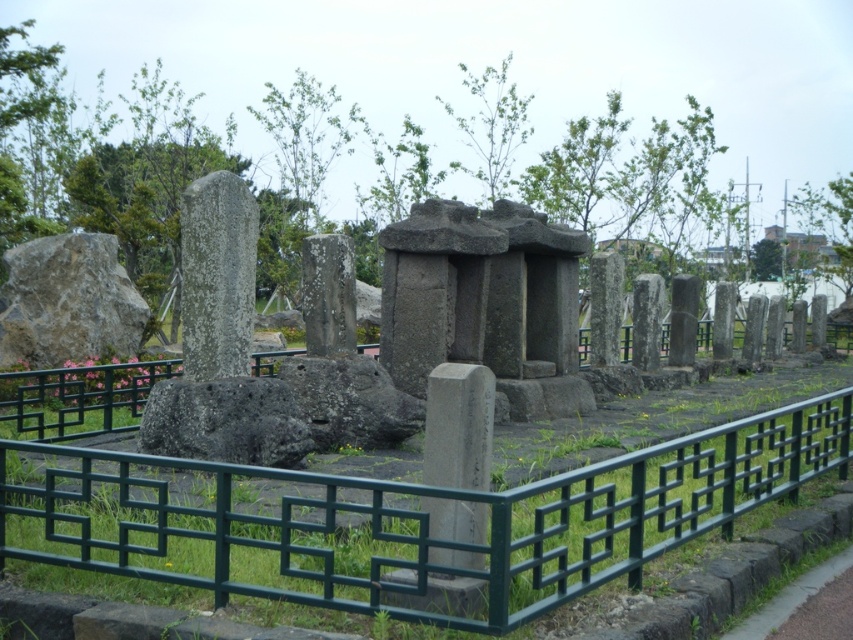
You are a tour guide explaining the historical site to visitors. You point out the gray stone pillar at center and the smooth gray stone monument at center. Which of these two objects has a smaller width?

The gray stone pillar at center is thinner than the smooth gray stone monument at center, so the gray stone pillar at center has a smaller width.

You are standing in the outdoor area and want to touch both the green metal fence at center and the gray stone pillar at center. Which object should you reach for first to touch the one closer to you?

The green metal fence at center is closer to the viewer, so you should reach for it first to touch the one closer to you.